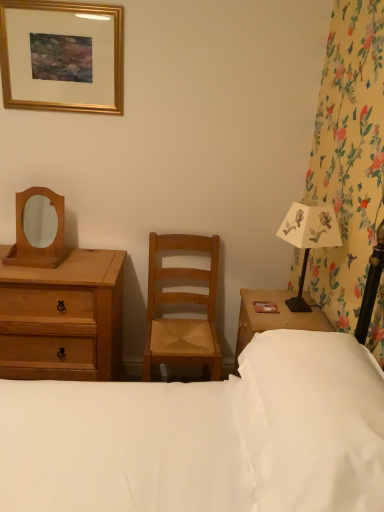
You are a GUI agent. You are given a task and a screenshot of the screen. Output one action in this format:
    pyautogui.click(x=<x>, y=<y>)
    Task: Click on the free space above gold wooden picture frame at upper left (from a real-world perspective)
    The width and height of the screenshot is (384, 512).
    Given the screenshot: What is the action you would take?
    pyautogui.click(x=48, y=3)